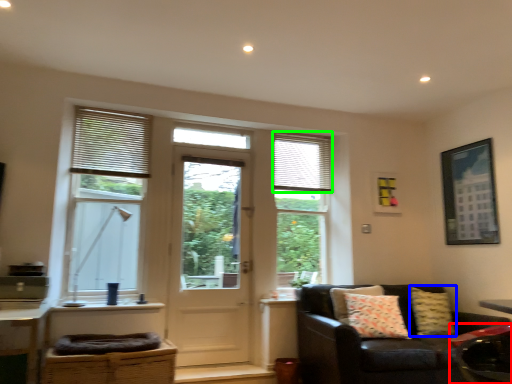
Question: Which is farther away from swivel chair (highlighted by a red box)? pillow (highlighted by a blue box) or shutter (highlighted by a green box)?

Choices:
 (A) pillow
 (B) shutter

Answer: (B)